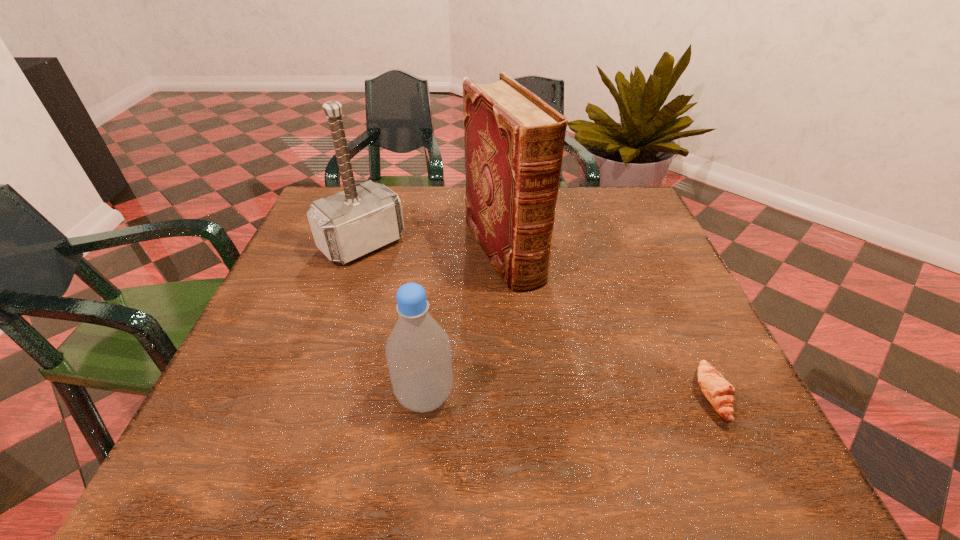
Where is `object that is at the near right corner`? object that is at the near right corner is located at coordinates (719, 392).

You are a GUI agent. You are given a task and a screenshot of the screen. Output one action in this format:
    pyautogui.click(x=<x>, y=<y>)
    Task: Click on the free space at the far edge of the desktop
    The height and width of the screenshot is (540, 960).
    Given the screenshot: What is the action you would take?
    pyautogui.click(x=442, y=215)

Where is `free space at the near edge of the desktop`? The image size is (960, 540). free space at the near edge of the desktop is located at coordinates (635, 384).

Find the location of `vacant space at the left edge of the desktop`. vacant space at the left edge of the desktop is located at coordinates (293, 294).

This screenshot has height=540, width=960. What are the coordinates of `vacant region at the right edge of the desktop` in the screenshot? It's located at (610, 242).

At what (x,y) coordinates should I click in order to perform the action: click on blank space at the far right corner. Please return your answer as a coordinate pair (x, y). This screenshot has width=960, height=540. Looking at the image, I should click on (604, 212).

This screenshot has height=540, width=960. In the image, there is a desktop. What are the coordinates of `vacant space at the near right corner` in the screenshot? It's located at (721, 420).

What are the coordinates of `free area in between the shortest object and the hardback book` in the screenshot? It's located at (609, 324).

Identify the location of free space between the hammer and the second object from right to left. (433, 248).

Find the location of `vacant area that lies between the second shortest object and the shortest object`. vacant area that lies between the second shortest object and the shortest object is located at coordinates (568, 396).